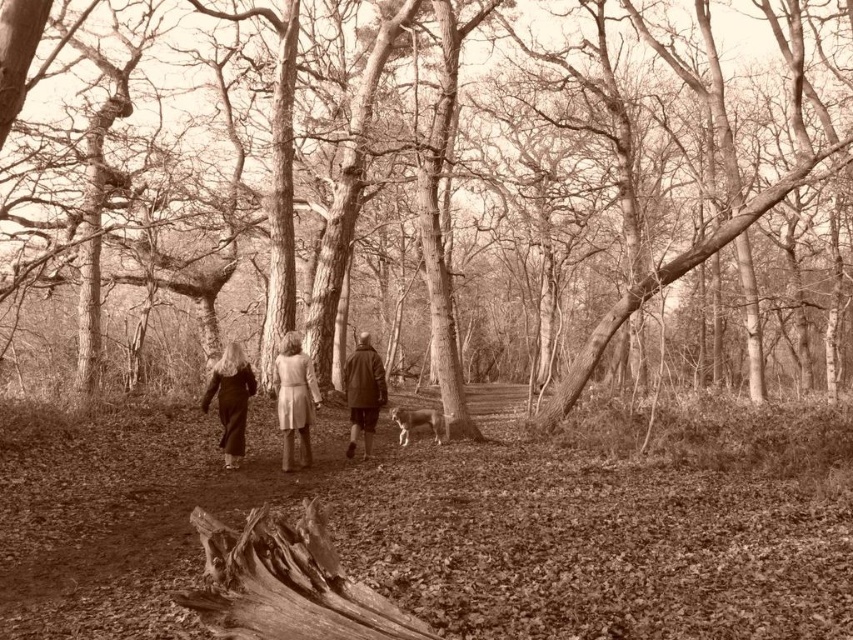
Who is more distant from viewer, [283,349] or [354,435]?

Positioned behind is point [354,435].

Is point (293, 396) in front of point (347, 369)?

Yes, point (293, 396) is closer to viewer.

Where is `light brown wool coat at center`? The image size is (853, 640). light brown wool coat at center is located at coordinates (294, 397).

Which is more to the left, matte black coat at center or dark brown leather jacket at center?

matte black coat at center

Between point (225, 438) and point (354, 429), which one is positioned behind?

The point (354, 429) is behind.

Locate an element on the screen. The image size is (853, 640). matte black coat at center is located at coordinates (230, 400).

Can you confirm if light brown wool coat at center is shorter than matte black coat at center?

In fact, light brown wool coat at center may be taller than matte black coat at center.

Which is in front, point (300, 384) or point (230, 406)?

Point (300, 384) is more forward.

Identify the location of light brown wool coat at center. The width and height of the screenshot is (853, 640). point(294,397).

Find the location of a particular element. The height and width of the screenshot is (640, 853). light brown wool coat at center is located at coordinates (294, 397).